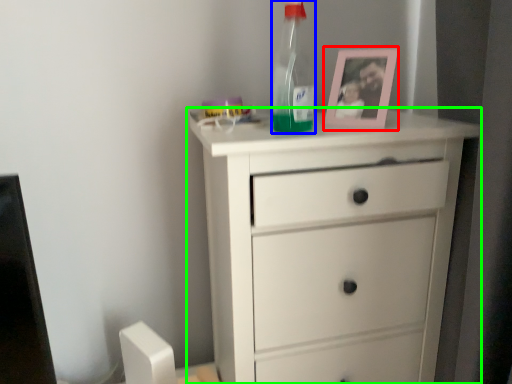
Question: Considering the real-world distances, which object is farthest from picture frame (highlighted by a red box)? bottle (highlighted by a blue box) or chest of drawers (highlighted by a green box)?

Choices:
 (A) bottle
 (B) chest of drawers

Answer: (B)